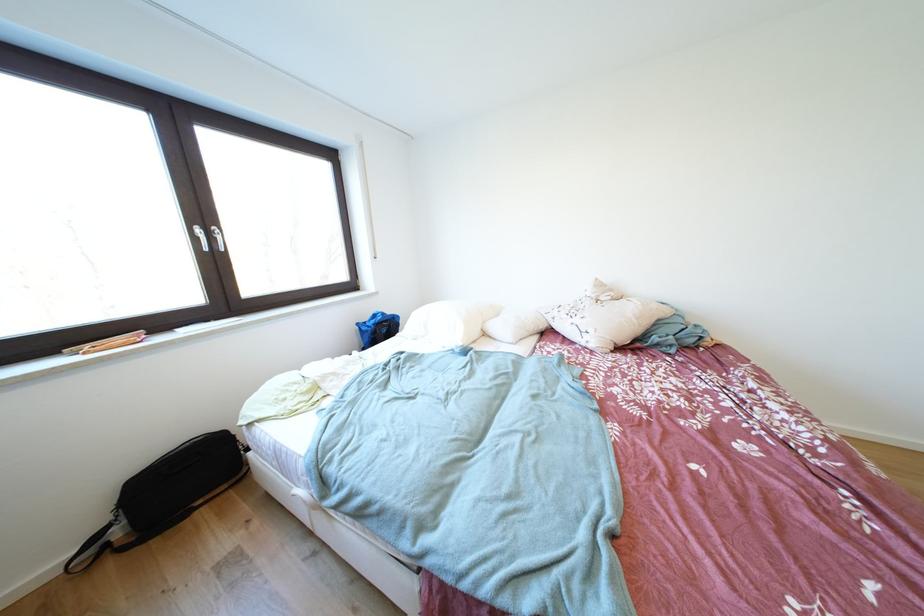
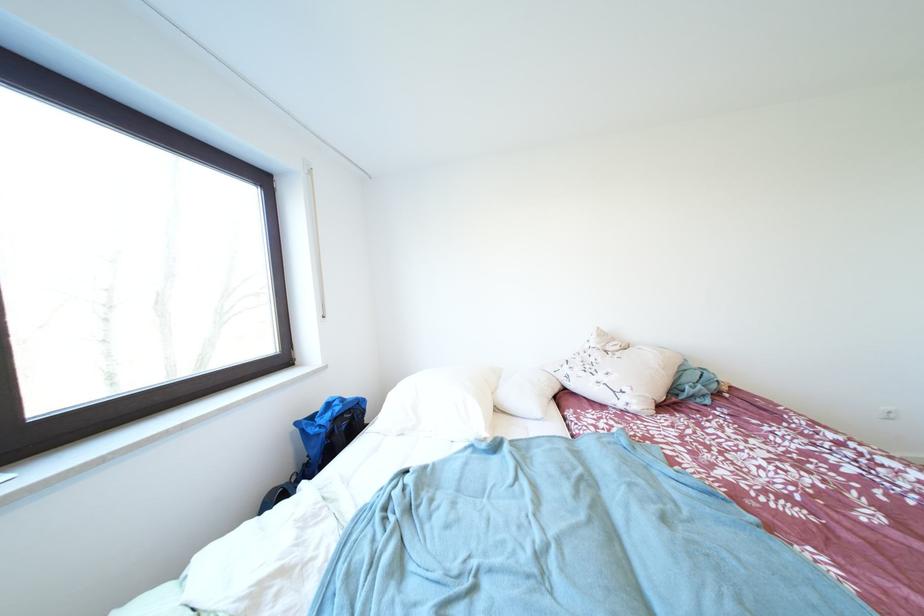
The point at (604, 284) is marked in the first image. Where is the corresponding point in the second image?

(606, 333)